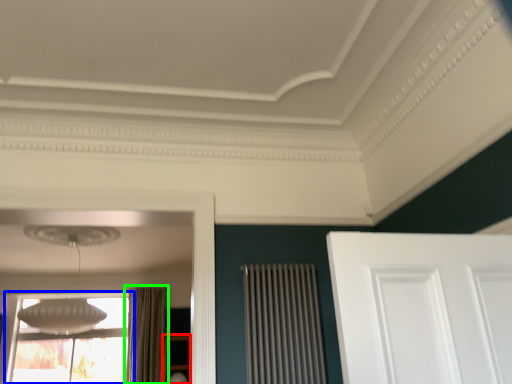
Question: Which is farther away from furniture (highlighted by a red box)? window (highlighted by a blue box) or curtain (highlighted by a green box)?

Choices:
 (A) window
 (B) curtain

Answer: (A)